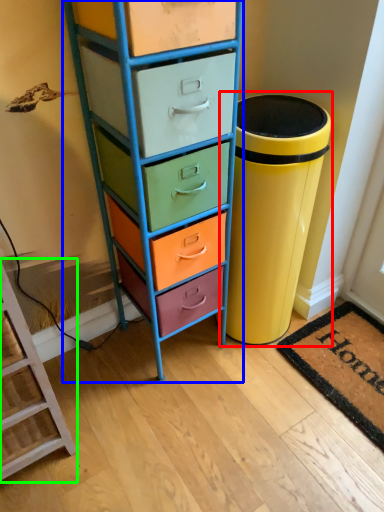
Question: Which object is positioned closest to waste container (highlighted by a red box)? Select from chest of drawers (highlighted by a blue box) and furniture (highlighted by a green box).

Choices:
 (A) chest of drawers
 (B) furniture

Answer: (A)